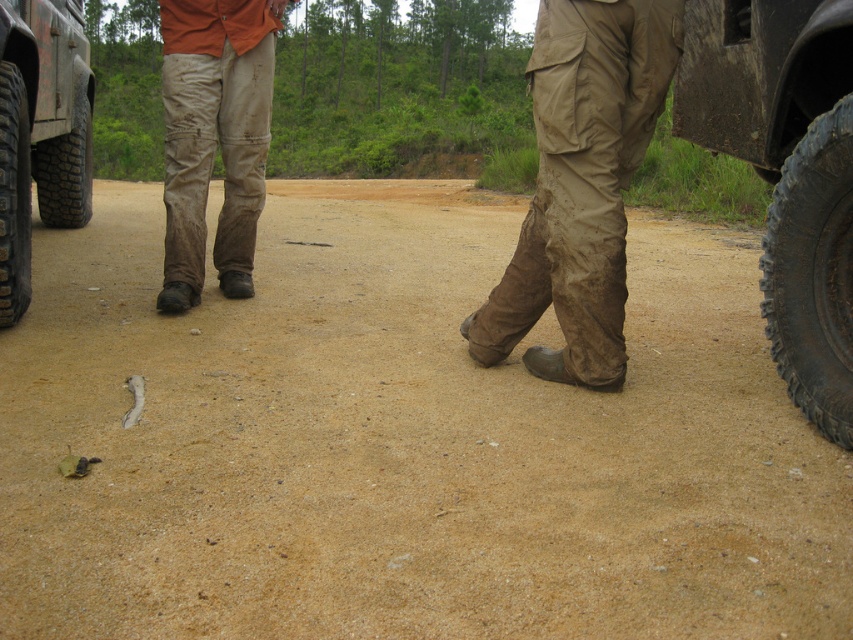
Question: Is worn canvas pants at center to the right of black rubber tire at right from the viewer's perspective?

Choices:
 (A) yes
 (B) no

Answer: (B)

Question: Which point is closer to the camera?

Choices:
 (A) rubber tread tire at right
 (B) black rubber tire at left
 (C) rubber/rough tire at left
 (D) worn khaki pants at center

Answer: (A)

Question: Can you confirm if rubber tread tire at right is bigger than black rugged tire at left?

Choices:
 (A) no
 (B) yes

Answer: (B)

Question: Is black rubber tire at right in front of black rugged tire at left?

Choices:
 (A) no
 (B) yes

Answer: (B)

Question: Which is nearer to the black rubber tire at left?

Choices:
 (A) brown dirt field at center
 (B) black rubber tire at right

Answer: (A)

Question: Among these objects, which one is nearest to the camera?

Choices:
 (A) black rugged tire at left
 (B) black rubber tire at left
 (C) rubber tread tire at right

Answer: (C)